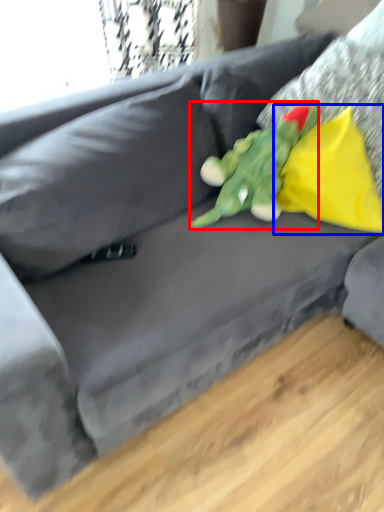
Question: Among these objects, which one is nearest to the camera, toy (highlighted by a red box) or pillow (highlighted by a blue box)?

Choices:
 (A) toy
 (B) pillow

Answer: (A)